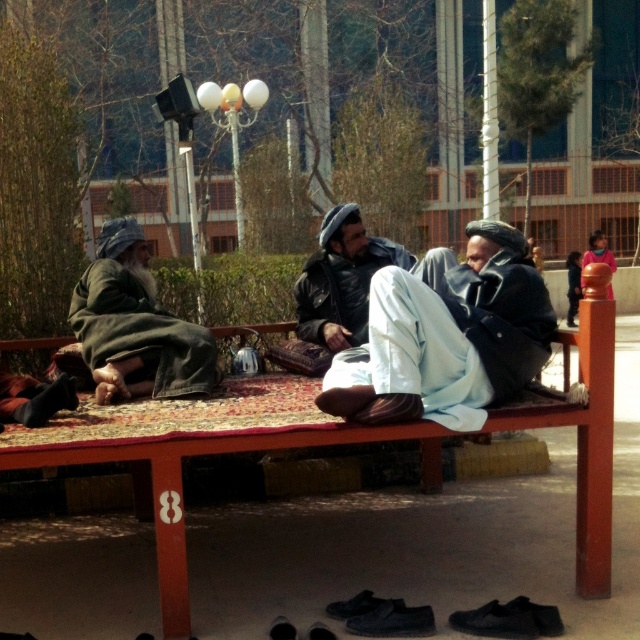
Image resolution: width=640 pixels, height=640 pixels. I want to click on denim jacket at left, so click(134, 324).

What do you see at coordinates (134, 324) in the screenshot?
I see `denim jacket at left` at bounding box center [134, 324].

The height and width of the screenshot is (640, 640). I want to click on denim jacket at left, so click(134, 324).

Can you confirm if wooden picnic table at center is thinner than leather jacket at center?

No, wooden picnic table at center is not thinner than leather jacket at center.

Is wooden picnic table at center behind leather jacket at center?

No, it is in front of leather jacket at center.

Is point (76, 456) closer to camera compared to point (326, 316)?

Yes.

Image resolution: width=640 pixels, height=640 pixels. In order to click on wooden picnic table at center in this screenshot , I will do `click(202, 452)`.

Measure the distance between point (72, 426) and camera.

Point (72, 426) and camera are 14.34 feet apart from each other.

At what (x,y) coordinates should I click in order to perform the action: click on wooden picnic table at center. Please return your answer as a coordinate pair (x, y). Looking at the image, I should click on (202, 452).

Find the location of `wooden picnic table at center`. wooden picnic table at center is located at coordinates (202, 452).